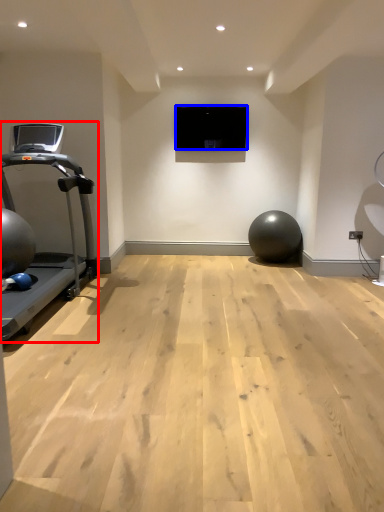
Question: Among these objects, which one is farthest to the camera, treadmill (highlighted by a red box) or projection screen (highlighted by a blue box)?

Choices:
 (A) treadmill
 (B) projection screen

Answer: (B)